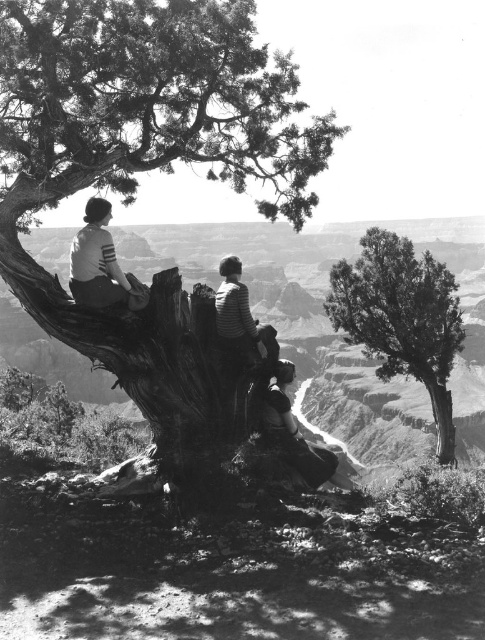
Based on the scene described, if someone wants to place a small birdhouse on the rough bark tree trunk at left so it is visible from the striped jersey at upper left, where should they position it?

The rough bark tree trunk at left is much taller than the striped jersey at upper left, so placing the birdhouse higher up on the rough bark tree trunk at left would ensure it is visible from the striped jersey at upper left.

You are standing at the center of the Grand Canyon scene in the photo. You want to move towards the rough bark tree trunk at left. Which direction should you walk to reach it?

Since the rough bark tree trunk at left is located at point 0.263 on the x and 0.297 on the y coordinate, you should walk towards the left direction to reach it.

You are a photographer planning to capture a landscape shot of the Grand Canyon. You have two trees in your frame. The rough bark tree trunk at left and the smooth bark tree at right. Which tree is positioned closer to the left side of your photo?

The rough bark tree trunk at left is positioned closer to the left side of the photo as it is to the left of the smooth bark tree at right.